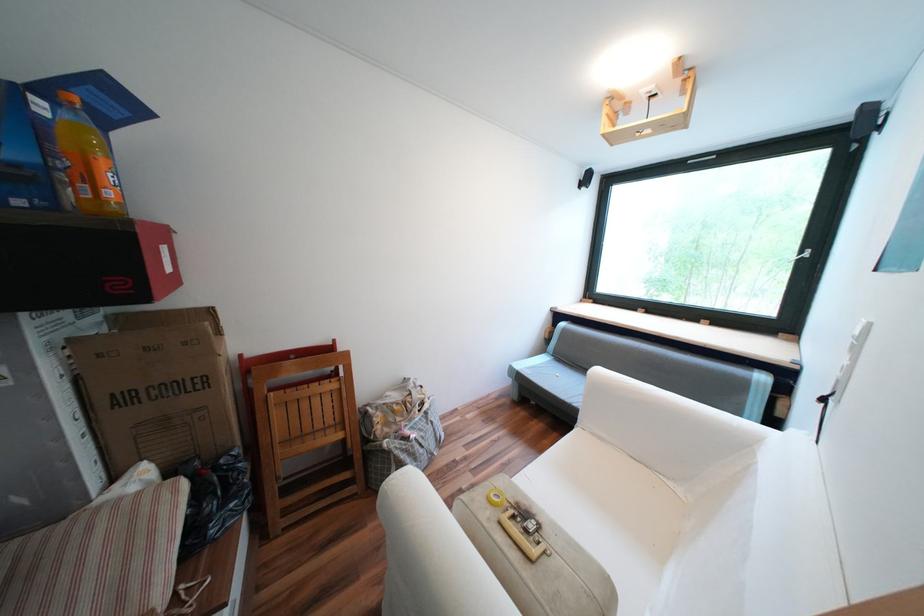
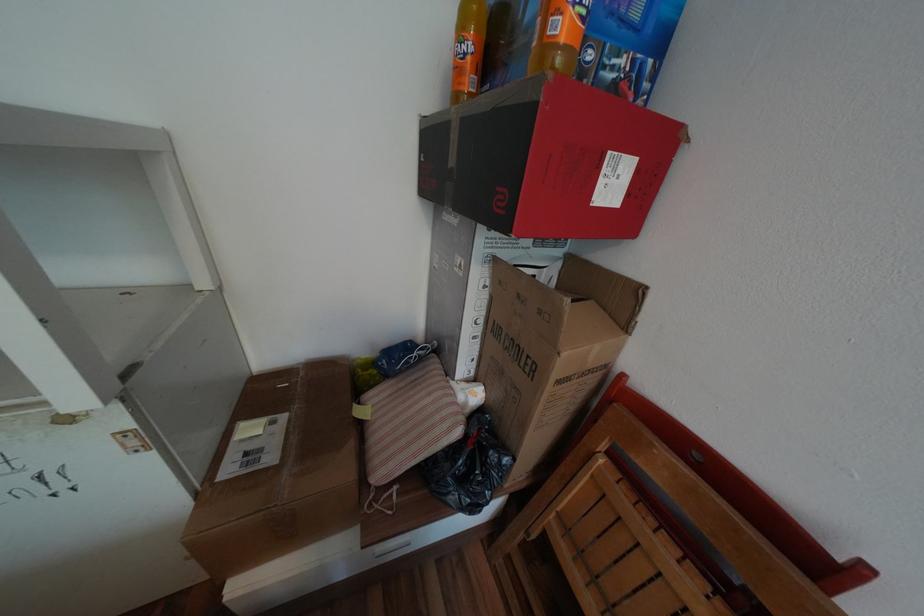
Locate, in the second image, the point that corresponds to [165,500] in the first image.

(453, 419)